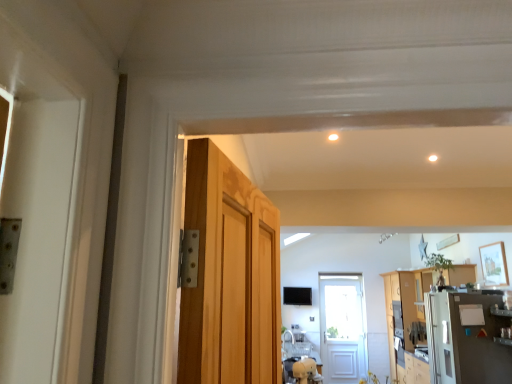
Find the location of `white glossy light at upper center`. white glossy light at upper center is located at coordinates point(333,137).

How distant is white glossy light at upper center from satin silver refrigerator at right?

A distance of 11.73 feet exists between white glossy light at upper center and satin silver refrigerator at right.

From a real-world perspective, is white glossy light at upper center positioned under satin silver refrigerator at right based on gravity?

No.

Which of these two, white glossy light at upper center or satin silver refrigerator at right, is smaller?

white glossy light at upper center.

Is white glossy light at upper center taller than satin silver refrigerator at right?

Incorrect, the height of white glossy light at upper center is not larger of that of satin silver refrigerator at right.

Is satin silver refrigerator at right at the back of wooden cabinet at right?

No, satin silver refrigerator at right is not at the back of wooden cabinet at right.

Between point (451, 283) and point (431, 317), which one is positioned behind?

The point (451, 283) is behind.

From a real-world perspective, which is physically above, wooden cabinet at right or satin silver refrigerator at right?

From a 3D spatial view, satin silver refrigerator at right is above.

Locate an element on the screen. The height and width of the screenshot is (384, 512). cabinetry below the satin silver refrigerator at right (from a real-world perspective) is located at coordinates (406, 319).

Does satin silver refrigerator at right touch white glossy light at upper center?

No, satin silver refrigerator at right is not touching white glossy light at upper center.

Considering the sizes of satin silver refrigerator at right and white glossy light at upper center in the image, is satin silver refrigerator at right taller or shorter than white glossy light at upper center?

Considering their sizes, satin silver refrigerator at right has more height than white glossy light at upper center.

Would you say satin silver refrigerator at right contains white glossy light at upper center?

Definitely not — white glossy light at upper center is not inside satin silver refrigerator at right.

Does point (497, 350) appear closer or farther from the camera than point (334, 134)?

Point (497, 350) is farther from the camera than point (334, 134).

Are white glossy light at upper center and wooden cabinet at right located far from each other?

Indeed, white glossy light at upper center is not near wooden cabinet at right.

From the image's perspective, is white glossy light at upper center under wooden cabinet at right?

No, from the image's perspective, white glossy light at upper center is not below wooden cabinet at right.

Is white glossy light at upper center wider or thinner than wooden cabinet at right?

In the image, white glossy light at upper center appears to be more narrow than wooden cabinet at right.

Is white glossy light at upper center positioned with its back to wooden cabinet at right?

That's not correct — white glossy light at upper center is not looking away from wooden cabinet at right.

Considering the sizes of satin silver refrigerator at right and wooden cabinet at right in the image, is satin silver refrigerator at right wider or thinner than wooden cabinet at right?

Considering their sizes, satin silver refrigerator at right looks broader than wooden cabinet at right.

Is satin silver refrigerator at right outside of wooden cabinet at right?

That's correct, satin silver refrigerator at right is outside of wooden cabinet at right.

Are satin silver refrigerator at right and wooden cabinet at right making contact?

They are not placed beside each other.

Is wooden cabinet at right far from white glossy light at upper center?

wooden cabinet at right is positioned a significant distance from white glossy light at upper center.

Considering the sizes of objects wooden cabinet at right and white glossy light at upper center in the image provided, who is taller, wooden cabinet at right or white glossy light at upper center?

Standing taller between the two is wooden cabinet at right.

Can you confirm if wooden cabinet at right is smaller than white glossy light at upper center?

No, wooden cabinet at right is not smaller than white glossy light at upper center.

From the image's perspective, who appears lower, wooden cabinet at right or white glossy light at upper center?

wooden cabinet at right is shown below in the image.

Locate an element on the screen. The image size is (512, 384). appliance that is below the white glossy light at upper center (from the image's perspective) is located at coordinates pyautogui.click(x=466, y=338).

Locate an element on the screen. The height and width of the screenshot is (384, 512). cabinetry behind the satin silver refrigerator at right is located at coordinates (406, 319).

Considering their positions, is wooden cabinet at right positioned closer to satin silver refrigerator at right than white glossy light at upper center?

The object closer to satin silver refrigerator at right is wooden cabinet at right.

From the image, which object appears to be farther from satin silver refrigerator at right, white glossy light at upper center or wooden cabinet at right?

The object further to satin silver refrigerator at right is white glossy light at upper center.

Looking at this image, when comparing their distances from white glossy light at upper center, does satin silver refrigerator at right or wooden cabinet at right seem further?

wooden cabinet at right is positioned further to the anchor white glossy light at upper center.

From the picture: Based on their spatial positions, is wooden cabinet at right or satin silver refrigerator at right further from white glossy light at upper center?

The object further to white glossy light at upper center is wooden cabinet at right.

Which object lies nearer to the anchor point wooden cabinet at right, white glossy light at upper center or satin silver refrigerator at right?

satin silver refrigerator at right is positioned closer to the anchor wooden cabinet at right.

Considering their positions, is satin silver refrigerator at right positioned further to wooden cabinet at right than white glossy light at upper center?

white glossy light at upper center is further to wooden cabinet at right.

Where is `appliance positioned between white glossy light at upper center and wooden cabinet at right from near to far`? The width and height of the screenshot is (512, 384). appliance positioned between white glossy light at upper center and wooden cabinet at right from near to far is located at coordinates (466, 338).